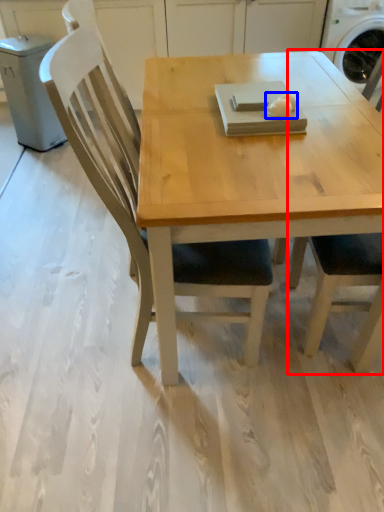
Question: Which of the following is the farthest to the observer, chair (highlighted by a red box) or food (highlighted by a blue box)?

Choices:
 (A) chair
 (B) food

Answer: (B)